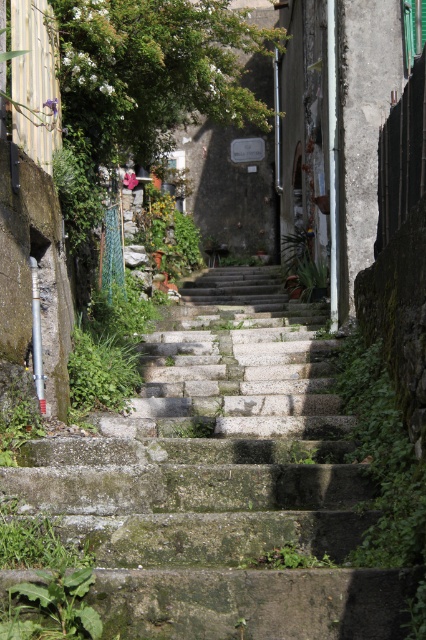
You are a gardener trying to clear the green mossy stone stairs at center and the green leafy weed at lower left. Which object requires more effort to remove due to its size?

The green mossy stone stairs at center requires more effort to remove because it has a larger size compared to the green leafy weed at lower left.

You are a delivery person carrying a heavy box and need to walk up the green mossy stone stairs at center. There is also a green leafy weed at lower left. Which object is directly under your feet when you start climbing the stairs?

The green mossy stone stairs at center are positioned over the green leafy weed at lower left, so when you start climbing the stairs, your feet will first be directly on the green mossy stone stairs at center.

From the picture: You are a delivery person carrying a large box that is 1 meter wide. You need to navigate through the narrow alleyway shown in the scene. Can you pass through the area between the green mossy stone stairs at center and the green leafy weed at lower left without tilting the box?

The green mossy stone stairs at center are wider than the green leafy weed at lower left. Since the box is 1 meter wide, you need to check if the available space between them is at least 1 meter. However, the exact distance isn